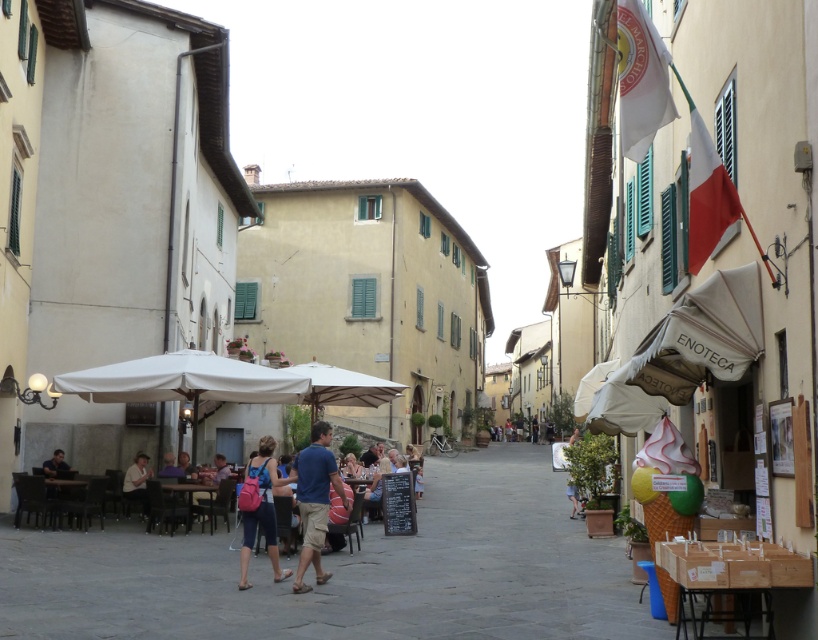
You are standing at the point with coordinates point (580, 497) and want to walk to the point with coordinates point (309, 529). Which direction should you move to reach your destination?

You should move forward because point (309, 529) is in front of point (580, 497).

You are a tourist walking down the street and want to sit under the white fabric umbrella at center. However, there is a person wearing a blue cotton shirt at center in your way. Based on the scene description, can you determine which direction you should move to reach the umbrella without disturbing the person?

The white fabric umbrella at center is positioned on the left side of the blue cotton shirt at center. To reach the umbrella without disturbing the person, you should move to the left side of the blue cotton shirt at center.

Based on the photo, you are a tourist in the Italian town and want to take a photo of the blue cotton shirt at center and the light blue denim shorts at lower right. Which clothing item appears smaller in the photo?

The blue cotton shirt at center appears smaller in the photo compared to the light blue denim shorts at lower right because it has a smaller size.